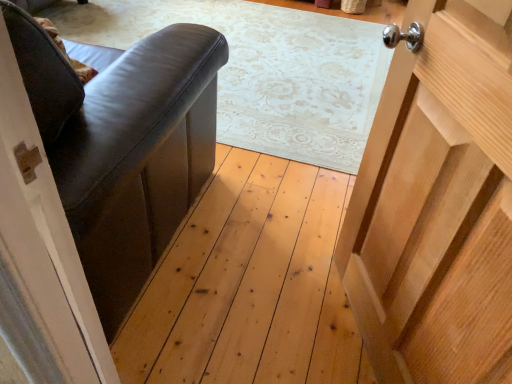
Question: From a real-world perspective, is matte black leather armchair at left physically located above or below wooden door at right?

Choices:
 (A) below
 (B) above

Answer: (A)

Question: Considering their positions, is matte black leather armchair at left located in front of or behind wooden door at right?

Choices:
 (A) behind
 (B) front

Answer: (A)

Question: Would you say matte black leather armchair at left is inside or outside wooden door at right?

Choices:
 (A) outside
 (B) inside

Answer: (A)

Question: Is wooden door at right spatially inside matte black leather armchair at left, or outside of it?

Choices:
 (A) outside
 (B) inside

Answer: (A)

Question: In terms of width, does wooden door at right look wider or thinner when compared to matte black leather armchair at left?

Choices:
 (A) thin
 (B) wide

Answer: (A)

Question: In the image, is wooden door at right positioned in front of or behind matte black leather armchair at left?

Choices:
 (A) behind
 (B) front

Answer: (B)

Question: Based on their sizes in the image, would you say wooden door at right is bigger or smaller than matte black leather armchair at left?

Choices:
 (A) big
 (B) small

Answer: (B)